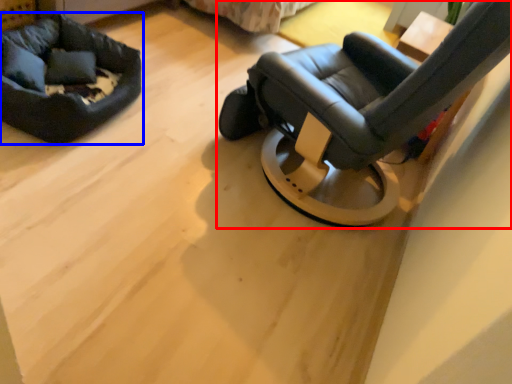
Question: Among these objects, which one is nearest to the camera, chair (highlighted by a red box) or dog bed (highlighted by a blue box)?

Choices:
 (A) chair
 (B) dog bed

Answer: (A)